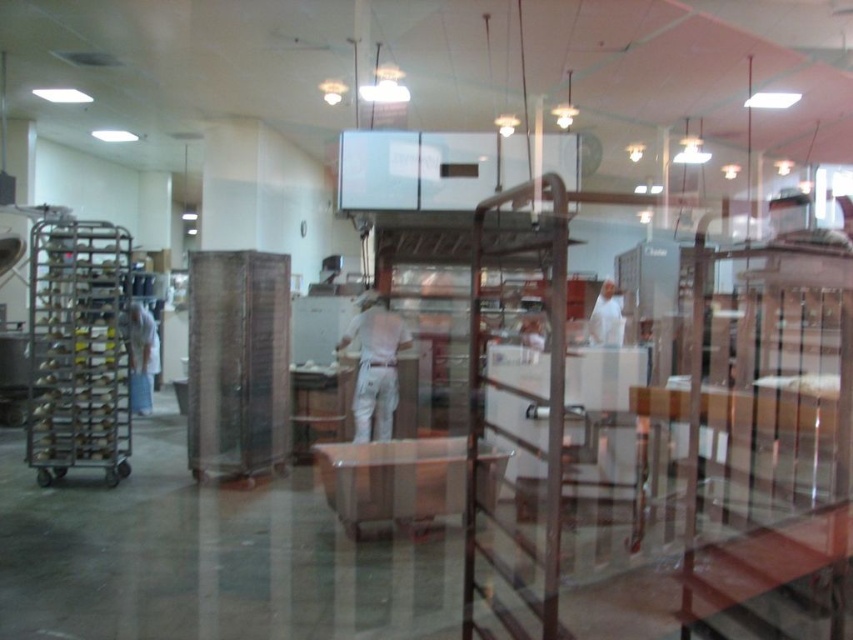
Question: Is white fabric shirt at center above white fabric shirt at left?

Choices:
 (A) yes
 (B) no

Answer: (A)

Question: Which point appears closest to the camera in this image?

Choices:
 (A) (368, 317)
 (B) (148, 400)

Answer: (A)

Question: Is white fabric shirt at center positioned behind white fabric shirt at left?

Choices:
 (A) no
 (B) yes

Answer: (A)

Question: Which object appears closest to the camera in this image?

Choices:
 (A) white fabric shirt at left
 (B) white fabric shirt at center

Answer: (B)

Question: Does white fabric shirt at center have a greater width compared to white fabric shirt at left?

Choices:
 (A) yes
 (B) no

Answer: (A)